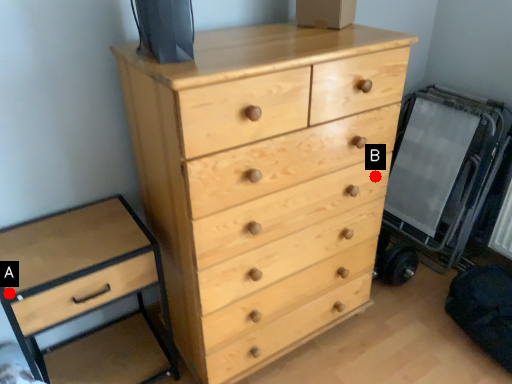
Question: Two points are circled on the image, labeled by A and B beside each circle. Which point is closer to the camera taking this photo?

Choices:
 (A) A is closer
 (B) B is closer

Answer: (A)